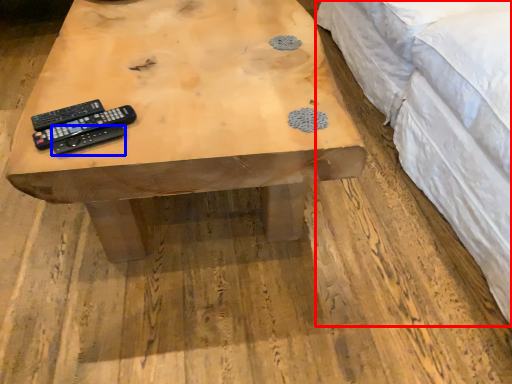
Question: Which object is closer to the camera taking this photo, bed (highlighted by a red box) or remote control (highlighted by a blue box)?

Choices:
 (A) bed
 (B) remote control

Answer: (A)